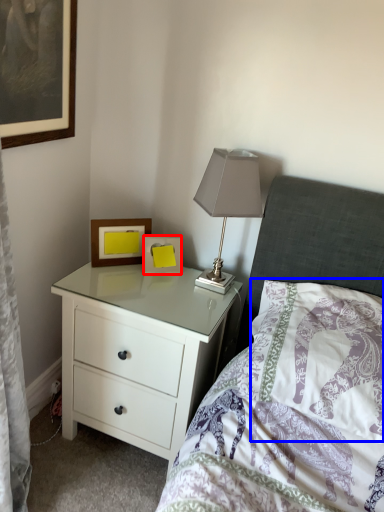
Question: Which object is closer to the camera taking this photo, picture frame (highlighted by a red box) or pillow (highlighted by a blue box)?

Choices:
 (A) picture frame
 (B) pillow

Answer: (B)